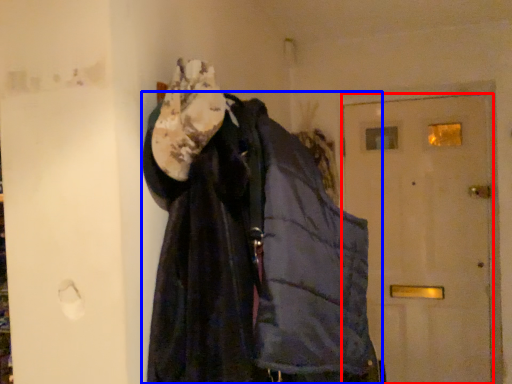
Question: Which point is closer to the camera, door (highlighted by a red box) or jacket (highlighted by a blue box)?

Choices:
 (A) door
 (B) jacket

Answer: (B)